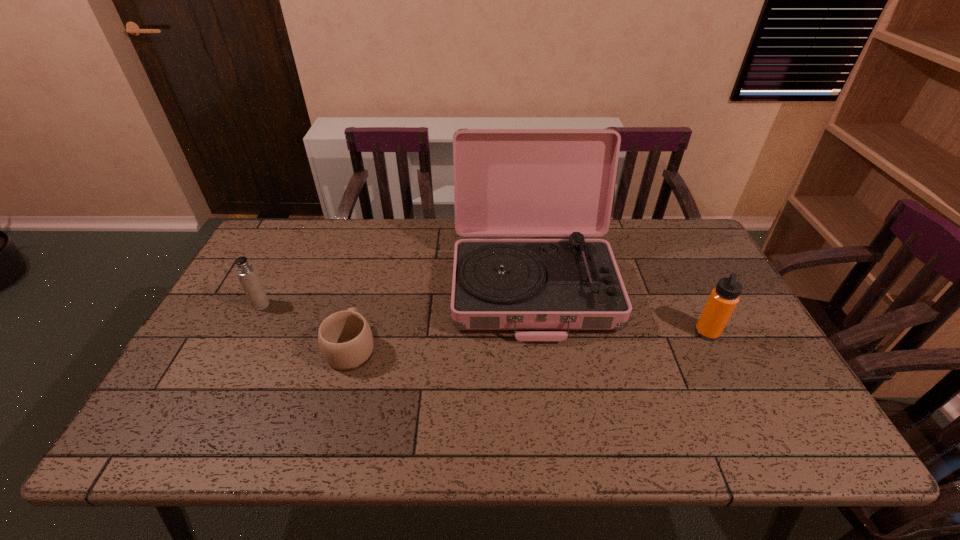
Identify the location of the tallest object. (507, 182).

Where is `record player`? record player is located at coordinates (507, 182).

The image size is (960, 540). I want to click on the nearer thermos bottle, so click(x=724, y=298).

Image resolution: width=960 pixels, height=540 pixels. I want to click on the right thermos bottle, so click(x=724, y=298).

Where is `the leftmost object`? the leftmost object is located at coordinates (245, 271).

Locate an element on the screen. the shorter thermos bottle is located at coordinates (245, 271).

Identify the location of the second object from left to right. click(x=345, y=338).

Where is `the shortest object`? the shortest object is located at coordinates (345, 338).

Find the location of a particular element. free location located 0.100m with the lid open on the third object from left to right is located at coordinates (544, 377).

At what (x,y) coordinates should I click in order to perform the action: click on vacant region located on the front of the nearer thermos bottle. Please return your answer as a coordinate pair (x, y). This screenshot has height=540, width=960. Looking at the image, I should click on (728, 373).